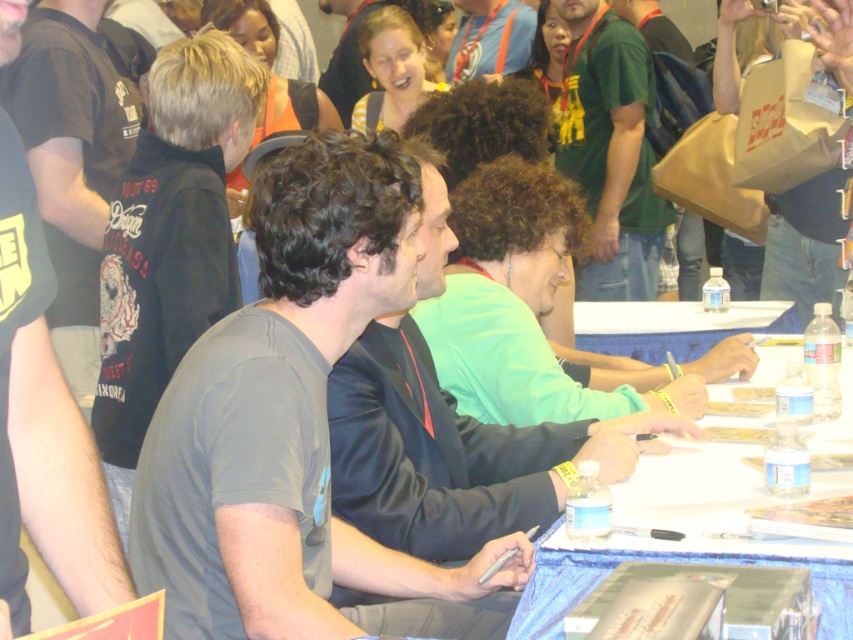
Question: Can you confirm if black t-shirt at left is wider than white paper at center?

Choices:
 (A) no
 (B) yes

Answer: (A)

Question: Which object is the closest to the gray matte t-shirt at center?

Choices:
 (A) green fabric shirt at upper center
 (B) white paper at center
 (C) black t-shirt at left

Answer: (C)

Question: Does white paper at center appear over matte black shirt at upper center?

Choices:
 (A) yes
 (B) no

Answer: (B)

Question: Can you confirm if blue fabric table at lower right is bigger than white paper at center?

Choices:
 (A) no
 (B) yes

Answer: (B)

Question: Which of the following is the closest to the observer?

Choices:
 (A) black t-shirt at left
 (B) matte black shirt at upper center
 (C) gray matte t-shirt at left
 (D) gray matte t-shirt at center

Answer: (A)

Question: Which point is farther from the camera taking this photo?

Choices:
 (A) pyautogui.click(x=229, y=561)
 (B) pyautogui.click(x=15, y=474)
 (C) pyautogui.click(x=201, y=308)

Answer: (C)